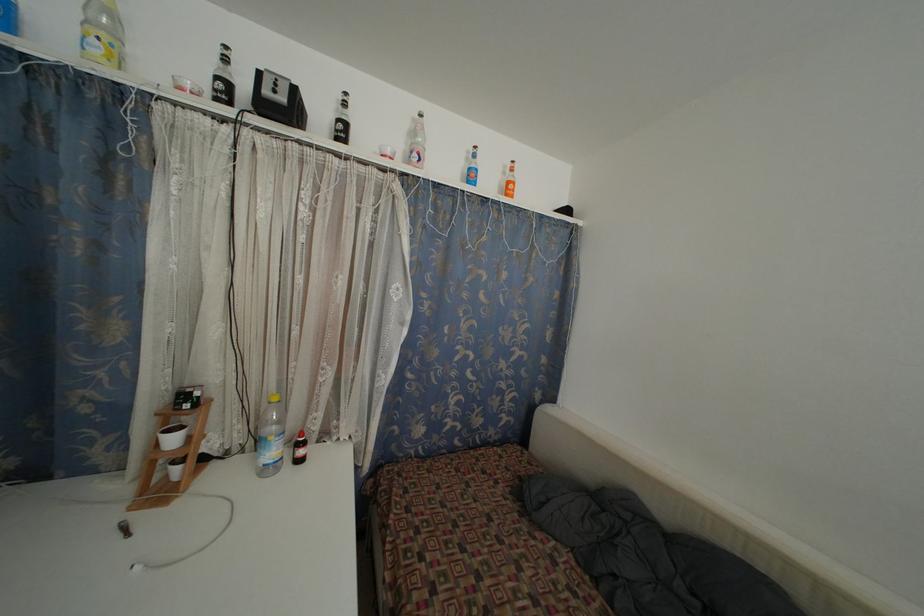
You are a GUI agent. You are given a task and a screenshot of the screen. Output one action in this format:
    pyautogui.click(x=<x>, y=<y>)
    Task: Click on the silver device button
    
    Given the screenshot: What is the action you would take?
    pyautogui.click(x=274, y=87)